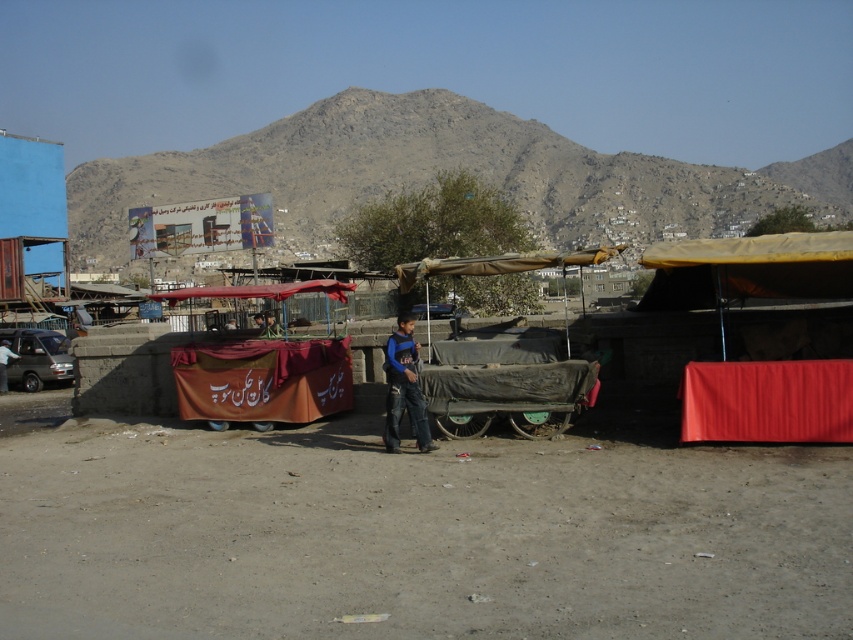
Is blue matte shirt at center bigger than metallic gray van at left?

No, blue matte shirt at center is not bigger than metallic gray van at left.

Is blue matte shirt at center to the left of metallic gray van at left from the viewer's perspective?

In fact, blue matte shirt at center is to the right of metallic gray van at left.

Who is more forward, (405,385) or (12,374)?

Point (405,385)

Locate an element on the screen. The image size is (853, 640). blue matte shirt at center is located at coordinates 404,387.

Is gray rocky mountain at upper center wider than blue matte shirt at center?

Yes, gray rocky mountain at upper center is wider than blue matte shirt at center.

Is point (624, 179) closer to camera compared to point (410, 333)?

No.

The image size is (853, 640). In order to click on gray rocky mountain at upper center in this screenshot , I will do `click(445, 168)`.

Is gray rocky mountain at upper center to the left of metallic gray van at left from the viewer's perspective?

No, gray rocky mountain at upper center is not to the left of metallic gray van at left.

Which is behind, point (618, 221) or point (45, 368)?

Point (618, 221)

You are a GUI agent. You are given a task and a screenshot of the screen. Output one action in this format:
    pyautogui.click(x=<x>, y=<y>)
    Task: Click on the gray rocky mountain at upper center
    Image resolution: width=853 pixels, height=640 pixels.
    Given the screenshot: What is the action you would take?
    point(445,168)

Where is `gray rocky mountain at upper center`? Image resolution: width=853 pixels, height=640 pixels. gray rocky mountain at upper center is located at coordinates pos(445,168).